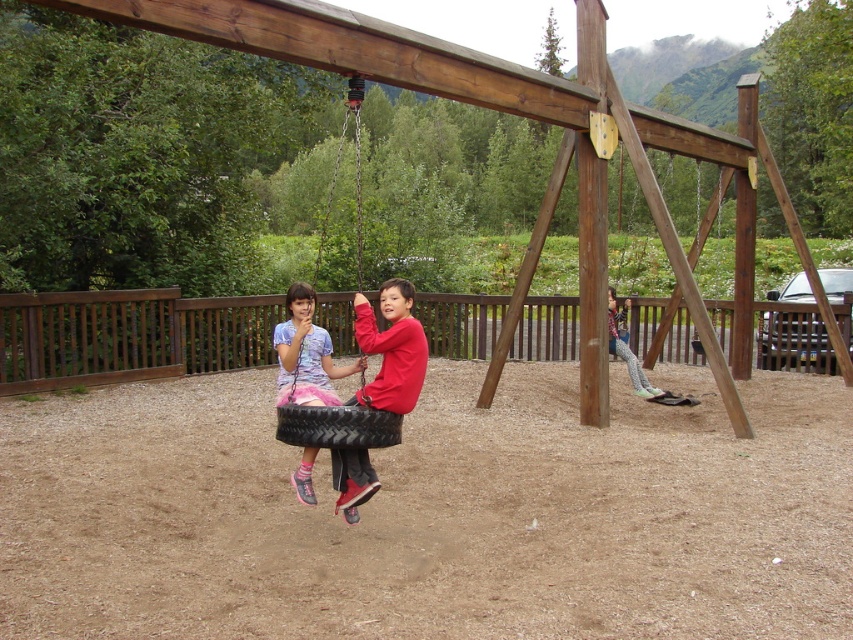
Is matte pink fabric tire swing at center above black rubber tire at center?

Correct, matte pink fabric tire swing at center is located above black rubber tire at center.

How much distance is there between matte pink fabric tire swing at center and black rubber tire at center?

12.90 inches

Does point (325, 362) come farther from viewer compared to point (395, 420)?

Yes, point (325, 362) is farther from viewer.

This screenshot has width=853, height=640. What are the coordinates of `matte pink fabric tire swing at center` in the screenshot? It's located at (306, 353).

Is black rubber tire at center smaller than printed fabric pants at lower right?

Yes.

Between black rubber tire at center and printed fabric pants at lower right, which one has less height?

Standing shorter between the two is black rubber tire at center.

Is point (285, 432) in front of point (608, 336)?

Yes, point (285, 432) is in front of point (608, 336).

Where is `black rubber tire at center`? The image size is (853, 640). black rubber tire at center is located at coordinates (337, 426).

Between point (292, 394) and point (634, 355), which one is positioned behind?

The point (634, 355) is behind.

Between matte pink fabric tire swing at center and printed fabric pants at lower right, which one is positioned higher?

matte pink fabric tire swing at center is above.

Between point (300, 384) and point (630, 356), which one is positioned in front?

Positioned in front is point (300, 384).

The height and width of the screenshot is (640, 853). Find the location of `matte pink fabric tire swing at center`. matte pink fabric tire swing at center is located at coordinates (306, 353).